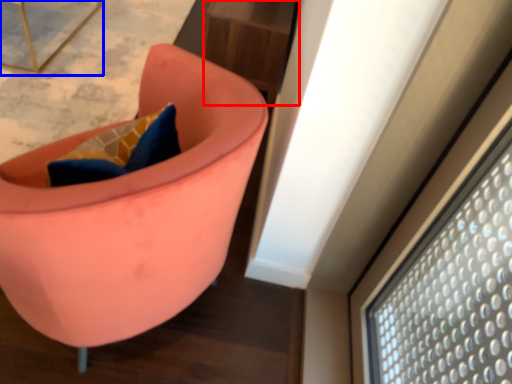
Question: Among these objects, which one is nearest to the camera, table (highlighted by a red box) or furniture (highlighted by a blue box)?

Choices:
 (A) table
 (B) furniture

Answer: (B)